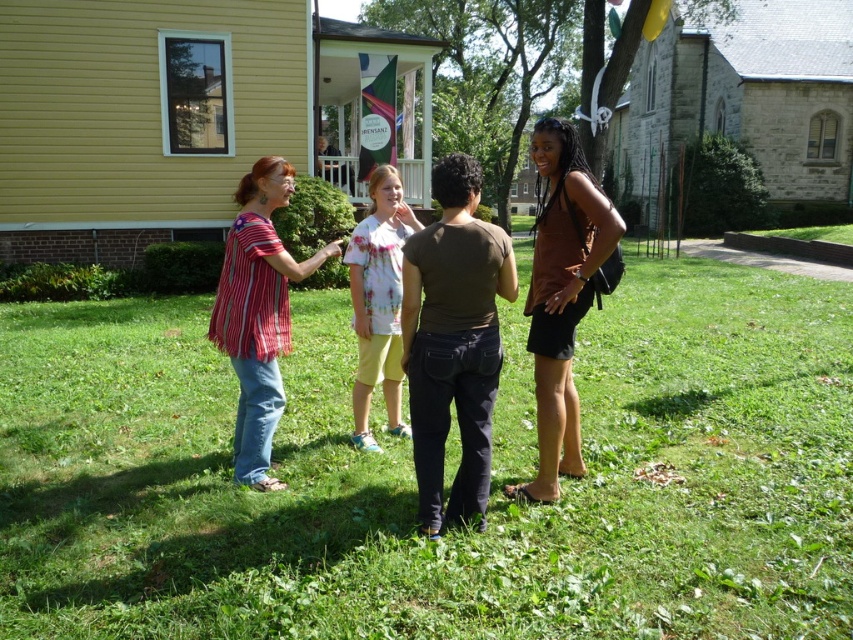
You are planning to place a small picnic basket on the green grass at center. Considering the size of the striped cotton shirt at center, will the basket fit comfortably without overlapping?

The green grass at center has a larger width than the striped cotton shirt at center, so the picnic basket should fit comfortably without overlapping.

You are planning to take a photo of the two people wearing the brown matte tank top at right and the striped cotton shirt at center. Which one should you zoom in on to capture more details without moving the camera?

The brown matte tank top at right is larger in size than the striped cotton shirt at center, so you should zoom in on the brown matte tank top at right to capture more details without moving the camera.